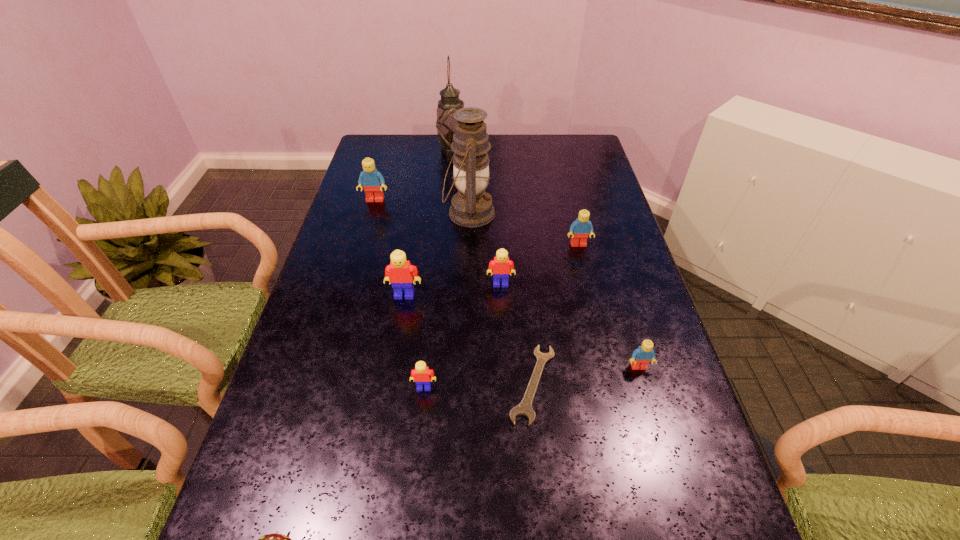
At what (x,y) coordinates should I click in order to perform the action: click on vacant space located 0.310m on the front-facing side of the fourth nearest Lego. Please return your answer as a coordinate pair (x, y). This screenshot has width=960, height=540. Looking at the image, I should click on (506, 392).

The image size is (960, 540). Find the location of `vacant space located 0.190m on the front-facing side of the nearest Lego`. vacant space located 0.190m on the front-facing side of the nearest Lego is located at coordinates (415, 483).

I want to click on free point located 0.100m on the face of the rightmost blue Lego, so click(x=653, y=414).

I want to click on vacant space situated on the left of the shortest object, so click(324, 384).

This screenshot has height=540, width=960. I want to click on object that is at the far edge, so click(450, 102).

What are the coordinates of `object at the left edge` in the screenshot? It's located at (373, 181).

In the image, there is a desktop. Identify the location of vacant space at the far edge. (409, 159).

I want to click on vacant region at the left edge of the desktop, so click(x=344, y=232).

I want to click on vacant region at the right edge, so click(x=591, y=207).

In the image, there is a desktop. At what (x,y) coordinates should I click in order to perform the action: click on vacant space at the far left corner. Please return your answer as a coordinate pair (x, y). The height and width of the screenshot is (540, 960). Looking at the image, I should click on (388, 160).